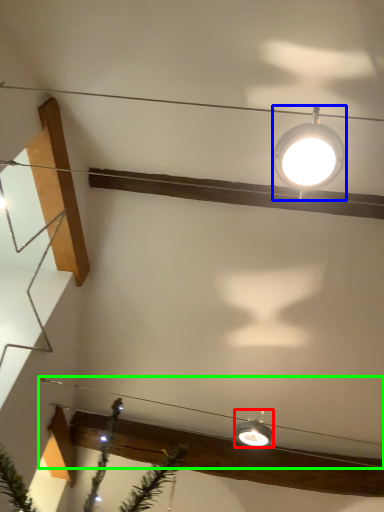
Question: Considering the real-world distances, which object is closest to lamp (highlighted by a red box)? lamp (highlighted by a blue box) or wire (highlighted by a green box).

Choices:
 (A) lamp
 (B) wire

Answer: (B)